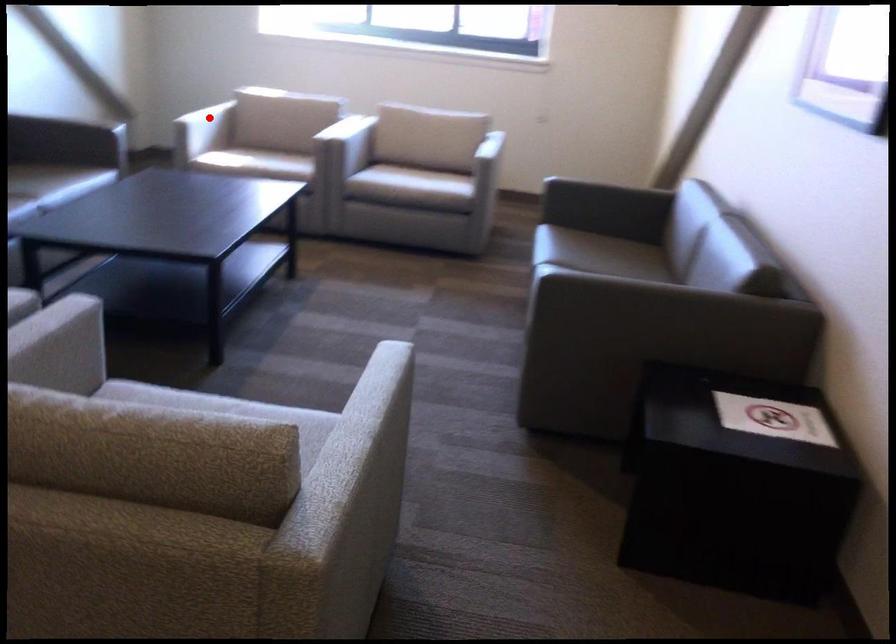
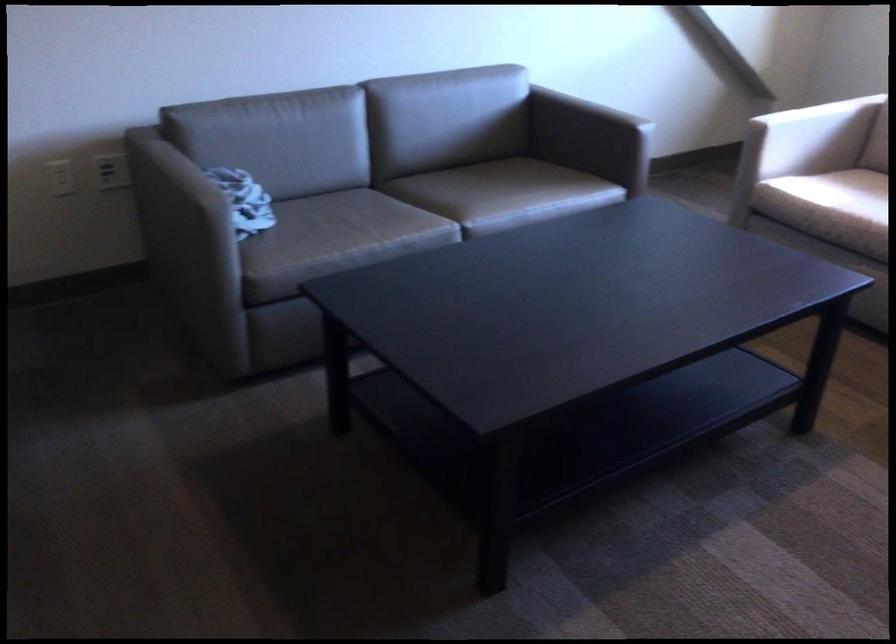
Find the pixel in the second image that matches the highlighted location in the first image.

(824, 137)